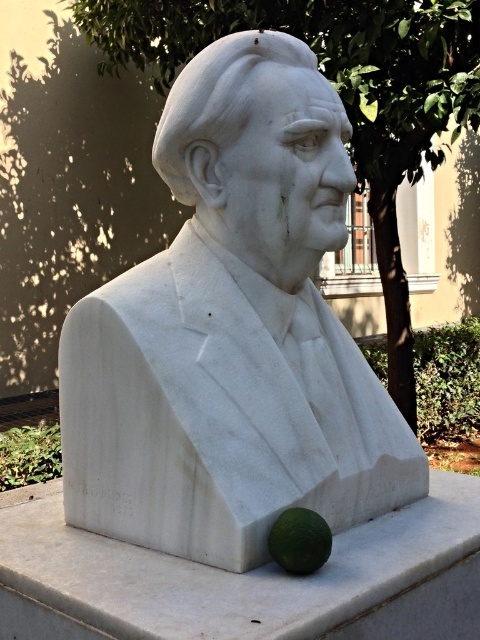
Is white marble bust at center to the right of green matte lime at lower center from the viewer's perspective?

No, white marble bust at center is not to the right of green matte lime at lower center.

Consider the image. Can you confirm if white marble bust at center is bigger than green matte lime at lower center?

Correct, white marble bust at center is larger in size than green matte lime at lower center.

The image size is (480, 640). I want to click on white marble bust at center, so click(232, 332).

Between white marble bust at center and white marble sphere at lower right, which one has less height?

Standing shorter between the two is white marble sphere at lower right.

Measure the distance between point (280, 84) and camera.

A distance of 2.33 meters exists between point (280, 84) and camera.

Identify the location of white marble bust at center. (232, 332).

Can you confirm if white marble sphere at lower right is positioned to the right of green matte lime at lower center?

No, white marble sphere at lower right is not to the right of green matte lime at lower center.

Is the position of white marble sphere at lower right more distant than that of green matte lime at lower center?

No.

Between point (479, 593) and point (284, 525), which one is positioned in front?

Point (284, 525) is in front.

Find the location of a particular element. white marble sphere at lower right is located at coordinates (244, 579).